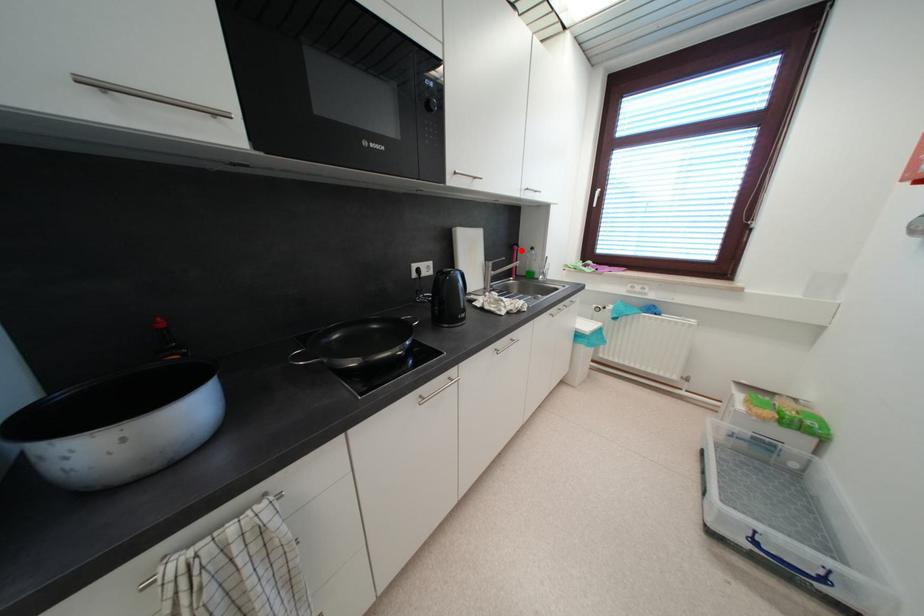
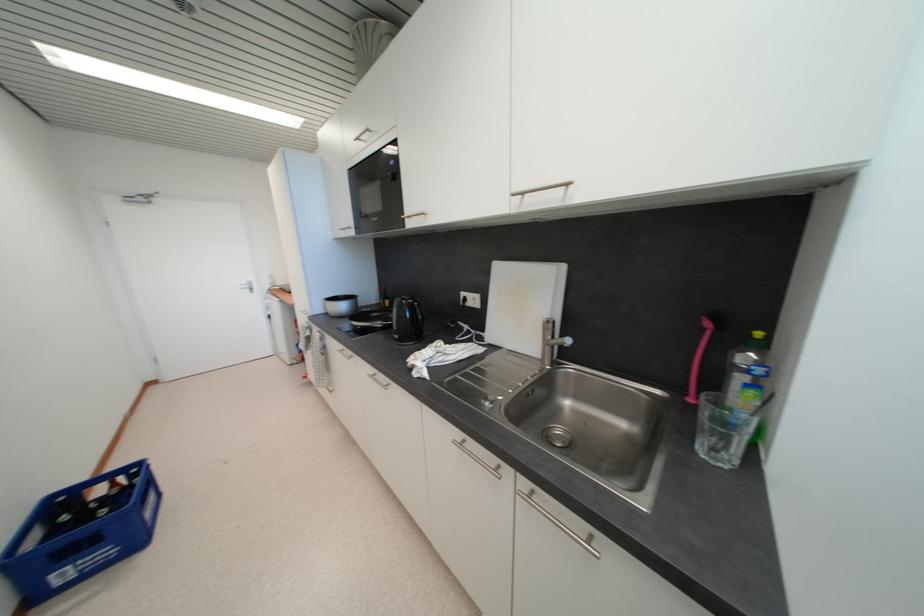
Question: A red point is marked in image1. In image2, is the corresponding 3D point closer to the camera or farther? Reply with the corresponding letter.

Choices:
 (A) The corresponding 3D point is closer.
 (B) The corresponding 3D point is farther.

Answer: (B)